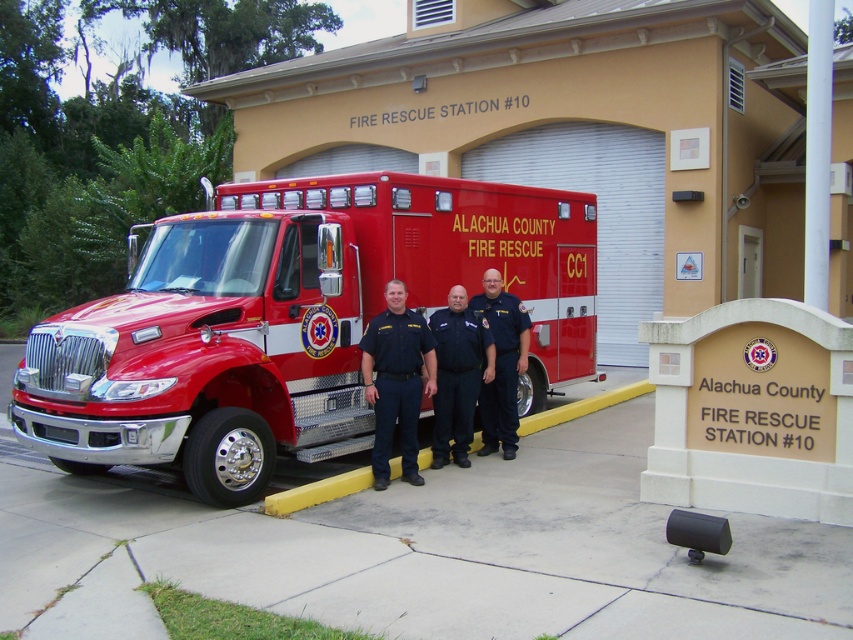
Question: Can you confirm if shiny red fire truck at center is smaller than black uniform at center?

Choices:
 (A) yes
 (B) no

Answer: (A)

Question: Considering the real-world distances, which object is closest to the blue fabric uniform at center?

Choices:
 (A) black uniform at center
 (B) dark blue fabric uniform at center

Answer: (B)

Question: Which point is farther from the camera taking this photo?

Choices:
 (A) (398, 284)
 (B) (453, 406)

Answer: (B)

Question: Considering the real-world distances, which object is closest to the black uniform at center?

Choices:
 (A) blue fabric uniform at center
 (B) dark blue fabric uniform at center

Answer: (B)

Question: Is shiny red fire truck at center above dark blue fabric uniform at center?

Choices:
 (A) no
 (B) yes

Answer: (A)

Question: Does dark blue fabric uniform at center appear on the right side of blue fabric uniform at center?

Choices:
 (A) no
 (B) yes

Answer: (A)